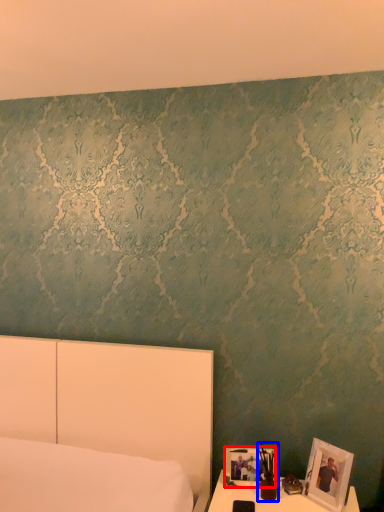
Question: Which object is closer to the camera taking this photo, picture frame (highlighted by a red box) or bedside lamp (highlighted by a blue box)?

Choices:
 (A) picture frame
 (B) bedside lamp

Answer: (B)